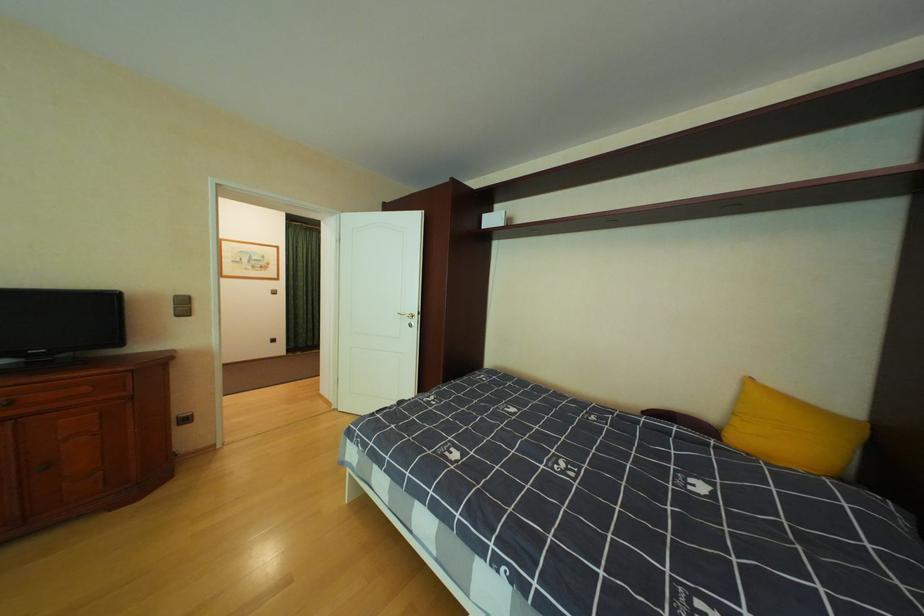
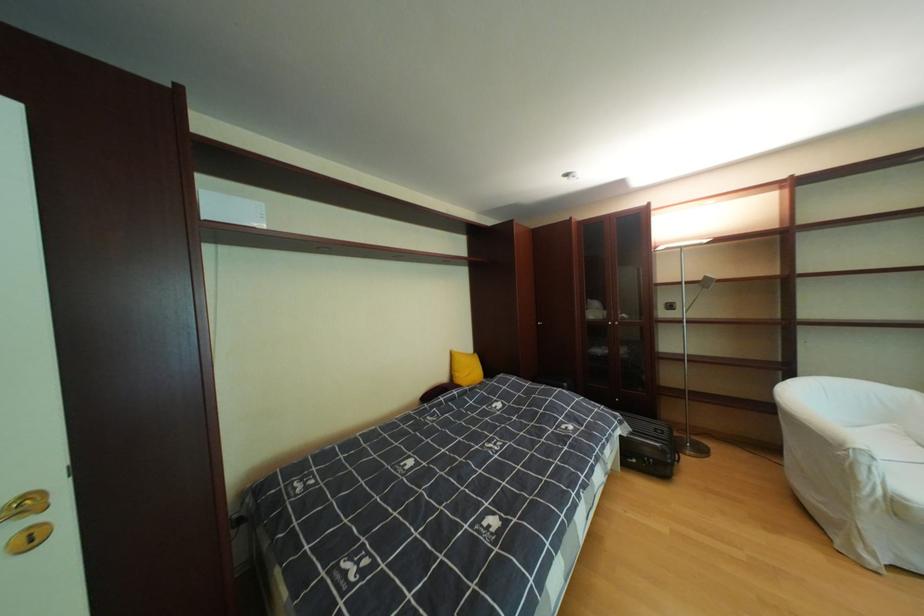
Find the pixel in the second image that matches pixel 423 326 in the first image.

(43, 541)